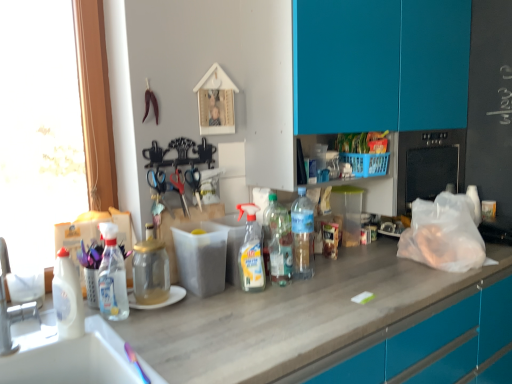
Question: Which direction should I rotate to look at translucent plastic spray bottle at center, placed as the 4th bottle when sorted from left to right, — up or down?

Choices:
 (A) up
 (B) down

Answer: (B)

Question: Which direction should I rotate to face clear plastic bottle at center, which is the sixth bottle in left-to-right order, — up or down?

Choices:
 (A) down
 (B) up

Answer: (A)

Question: Is white glossy bottle at left, the first bottle from the left, positioned far away from black plastic scissors at center, which is counted as the 1th scissors, starting from the right?

Choices:
 (A) no
 (B) yes

Answer: (A)

Question: Considering the relative sizes of white glossy bottle at left, which is the sixth bottle from right to left, and black plastic scissors at center, the 3th scissors positioned from the left, in the image provided, is white glossy bottle at left, which is the sixth bottle from right to left, taller than black plastic scissors at center, the 3th scissors positioned from the left,?

Choices:
 (A) yes
 (B) no

Answer: (A)

Question: From the image's perspective, is white glossy bottle at left, the first bottle from the left, located above black plastic scissors at center, which is counted as the 1th scissors, starting from the right?

Choices:
 (A) no
 (B) yes

Answer: (A)

Question: Considering the relative sizes of white glossy bottle at left, which is the sixth bottle from right to left, and black plastic scissors at center, which is counted as the 1th scissors, starting from the right, in the image provided, is white glossy bottle at left, which is the sixth bottle from right to left, shorter than black plastic scissors at center, which is counted as the 1th scissors, starting from the right,?

Choices:
 (A) no
 (B) yes

Answer: (A)

Question: Is white glossy bottle at left, the first bottle from the left, oriented away from black plastic scissors at center, which is counted as the 1th scissors, starting from the right?

Choices:
 (A) no
 (B) yes

Answer: (A)

Question: From the image's perspective, would you say white glossy bottle at left, which is the sixth bottle from right to left, is shown under black plastic scissors at center, the 3th scissors positioned from the left?

Choices:
 (A) yes
 (B) no

Answer: (A)

Question: Is metallic sheen scissors at center, which appears as the third scissors when viewed from the right, located outside clear plastic bottle at center, which is the sixth bottle in left-to-right order?

Choices:
 (A) no
 (B) yes

Answer: (B)

Question: Can you confirm if metallic sheen scissors at center, acting as the 1th scissors starting from the left, is shorter than clear plastic bottle at center, placed as the 1th bottle when sorted from right to left?

Choices:
 (A) yes
 (B) no

Answer: (A)

Question: Is clear plastic bottle at center, which is the sixth bottle in left-to-right order, at the back of metallic sheen scissors at center, which appears as the third scissors when viewed from the right?

Choices:
 (A) no
 (B) yes

Answer: (A)

Question: Is metallic sheen scissors at center, which appears as the third scissors when viewed from the right, placed right next to clear plastic bottle at center, placed as the 1th bottle when sorted from right to left?

Choices:
 (A) no
 (B) yes

Answer: (A)

Question: Is clear plastic bottle at center, which is the sixth bottle in left-to-right order, surrounded by metallic sheen scissors at center, acting as the 1th scissors starting from the left?

Choices:
 (A) no
 (B) yes

Answer: (A)

Question: Does metallic sheen scissors at center, acting as the 1th scissors starting from the left, turn towards clear plastic bottle at center, placed as the 1th bottle when sorted from right to left?

Choices:
 (A) yes
 (B) no

Answer: (B)

Question: From the image's perspective, is transparent plastic spray bottle at left, positioned as the second bottle in left-to-right order, beneath translucent plastic bottles at center, which appears as the fifth bottle when viewed from the left?

Choices:
 (A) no
 (B) yes

Answer: (B)